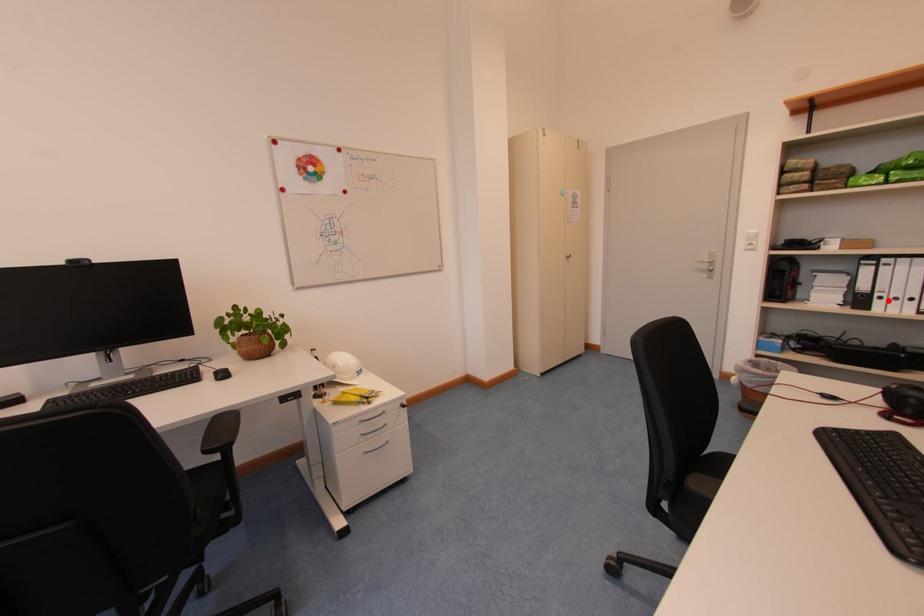
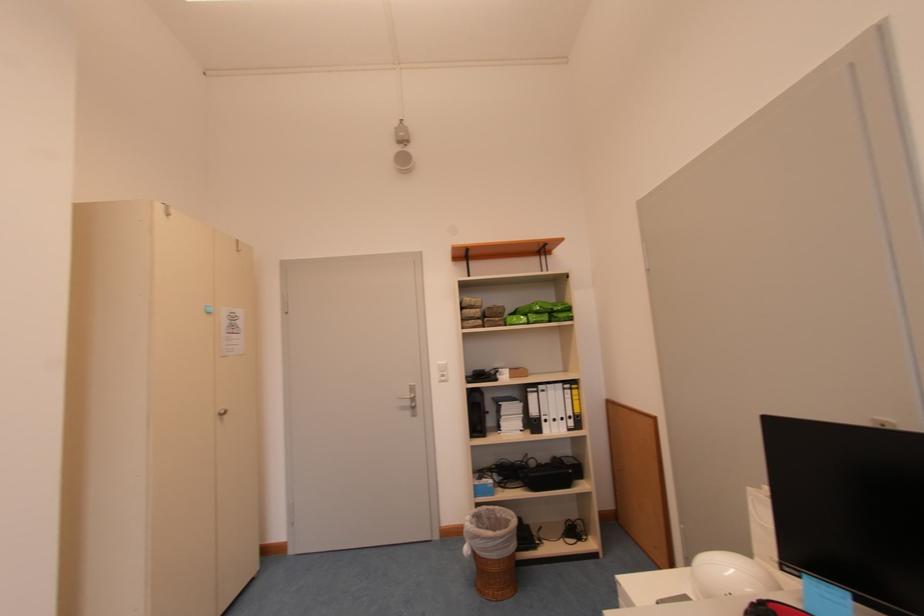
Find the pixel in the second image that matches the highlighted location in the first image.

(553, 424)